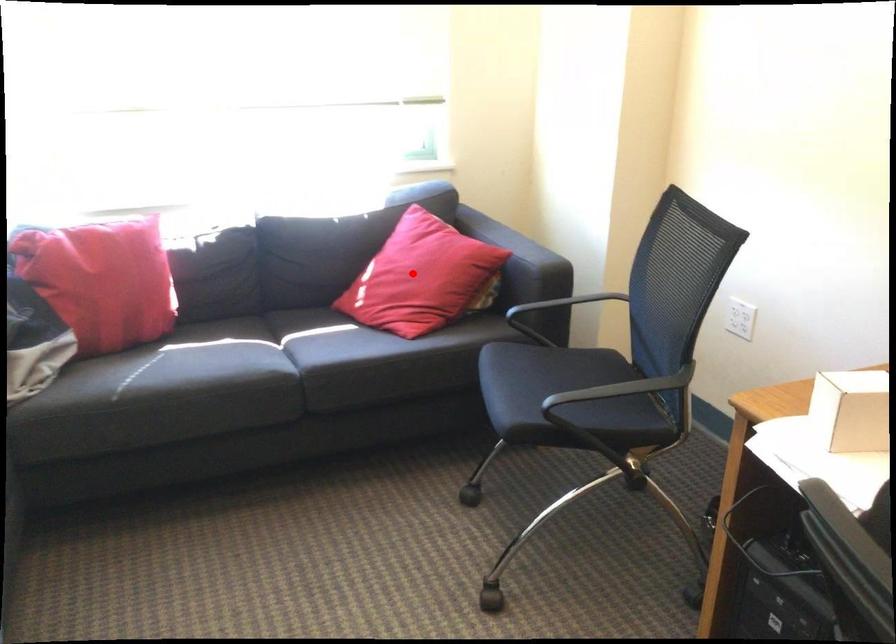
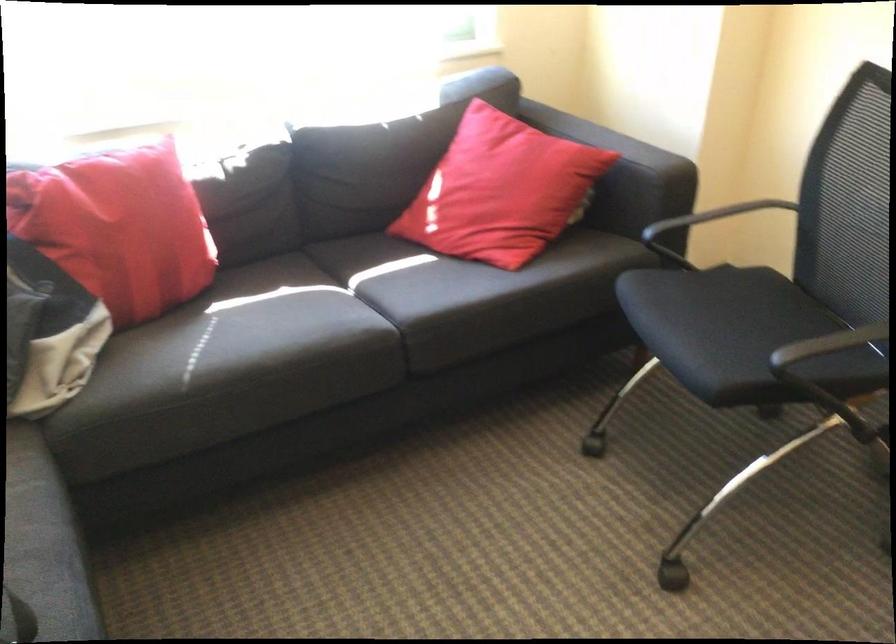
Where in the second image is the point corresponding to the highlighted location from the first image?

(501, 190)